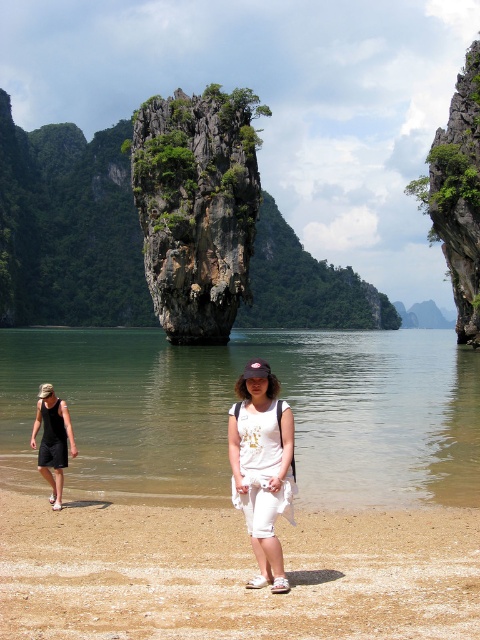
You are planning to set up a small tent for a beach picnic. Given the brown sandy beach at lower center and the green rocky cliff at right, which location would be more suitable for setting up the tent?

The brown sandy beach at lower center is more suitable for setting up the tent because it has a smaller size compared to the green rocky cliff at right, making it a flatter and more stable area for the tent.

You are planning to build a small sandcastle on the brown sandy beach at lower center. Considering the height of the green rocky cliff at right, will the sandcastle be shorter than the cliff?

The brown sandy beach at lower center is shorter than the green rocky cliff at right, so the sandcastle built on the beach will indeed be shorter than the cliff.

You are planning to build a small sandcastle on the brown sandy beach at lower center and the white cotton shorts at center. Which location has enough space for the sandcastle?

The white cotton shorts at center is larger than the brown sandy beach at lower center, so the sandcastle can be built on the white cotton shorts at center.